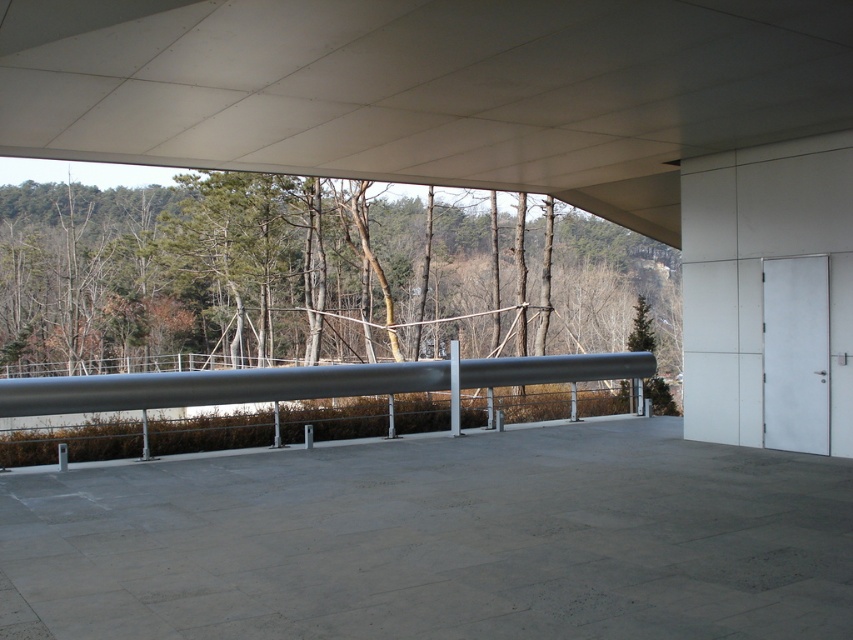
You are standing at the edge of the open area and want to step onto the gray concrete at center. Is the silver metallic rail at center in your way?

The gray concrete at center is closer to the viewer than the silver metallic rail at center, so the rail is not blocking the path to the concrete. You can step onto the gray concrete at center without obstruction.

In the scene shown: You are standing on the gray concrete at center and looking towards the green matte tree at center. Which object is taller?

The green matte tree at center is taller than the gray concrete at center.

You are standing at the edge of the open area and want to walk towards the green matte tree at center. Which direction should you move relative to the silver metallic rail at center?

The green matte tree at center is positioned on the left side of the silver metallic rail at center, so you should move to the left of the silver metallic rail at center to reach it.